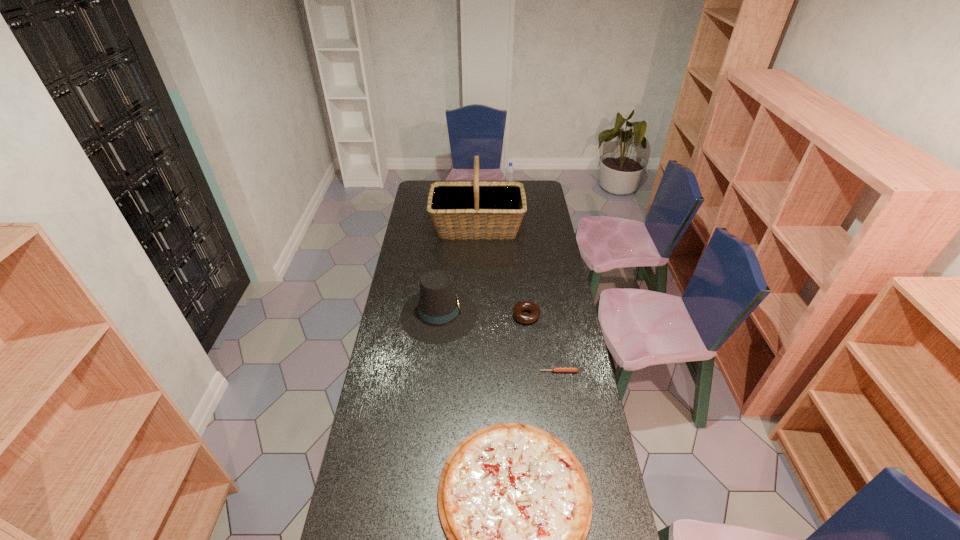
I want to click on free space at the far right corner of the desktop, so click(536, 180).

Locate an element on the screen. Image resolution: width=960 pixels, height=540 pixels. free point between the fifth farthest object and the doughnut is located at coordinates (542, 343).

In order to click on free spot between the sausage and the hat in this screenshot , I will do `click(499, 343)`.

Identify the location of free space that is in between the hat and the water bottle. (474, 254).

At what (x,y) coordinates should I click in order to perform the action: click on free space between the doughnut and the sausage. Please return your answer as a coordinate pair (x, y). Looking at the image, I should click on (542, 343).

Find the location of a particular element. The image size is (960, 540). vacant region between the farthest object and the doughnut is located at coordinates (517, 255).

Locate which object is the fifth closest to the second farthest object. Please provide its 2D coordinates. Your answer should be formatted as a tuple, i.e. [(x, y)], where the tuple contains the x and y coordinates of a point satisfying the conditions above.

[(515, 504)]

At what (x,y) coordinates should I click in order to perform the action: click on object that stands as the third closest to the second nearest object. Please return your answer as a coordinate pair (x, y). Looking at the image, I should click on (438, 314).

Image resolution: width=960 pixels, height=540 pixels. Find the location of `vacant region that satisfies the following two spatial constraints: 1. by the handle of the shortest object; 2. on the left side of the tallest object`. vacant region that satisfies the following two spatial constraints: 1. by the handle of the shortest object; 2. on the left side of the tallest object is located at coordinates (476, 372).

This screenshot has width=960, height=540. I want to click on vacant region that satisfies the following two spatial constraints: 1. on the front-facing side of the hat; 2. on the back side of the shortest object, so click(x=433, y=372).